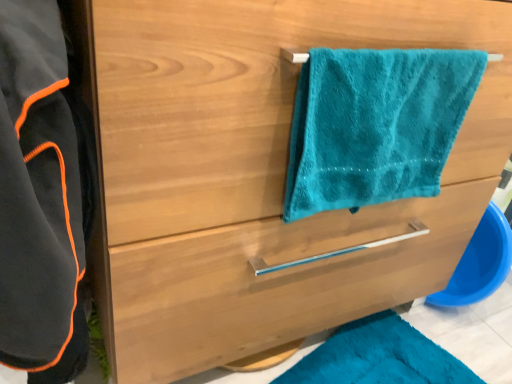
Question: In the image, is black fleece bathrobe at left positioned in front of or behind satin wood drawer at center?

Choices:
 (A) behind
 (B) front

Answer: (B)

Question: Based on their sizes in the image, would you say black fleece bathrobe at left is bigger or smaller than satin wood drawer at center?

Choices:
 (A) small
 (B) big

Answer: (B)

Question: Estimate the real-world distances between objects in this image. Which object is closer to the teal plush towel at upper right?

Choices:
 (A) satin wood drawer at center
 (B) black fleece bathrobe at left

Answer: (A)

Question: Based on their relative distances, which object is farther from the teal plush towel at upper right?

Choices:
 (A) satin wood drawer at center
 (B) black fleece bathrobe at left

Answer: (B)